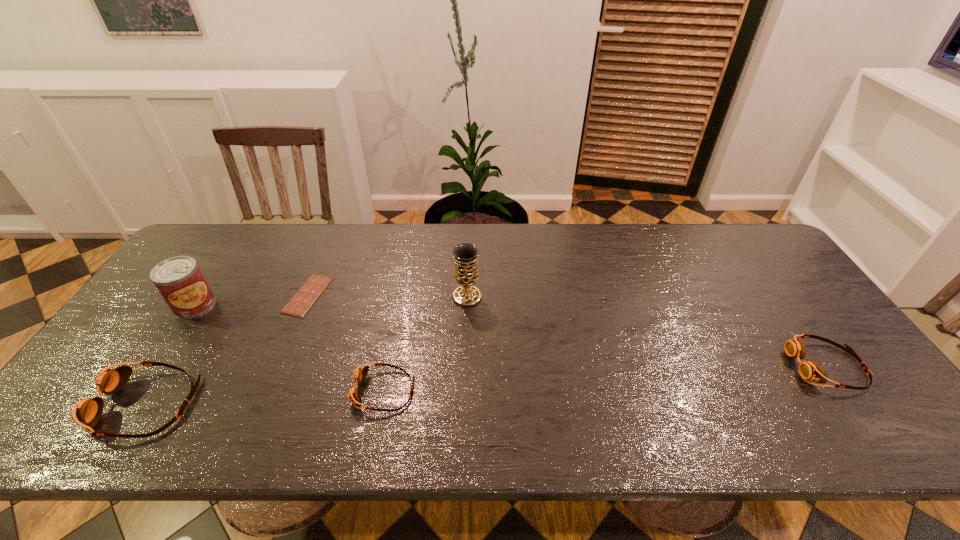
At what (x,y) coordinates should I click in order to perform the action: click on goggles at the left edge. Please return your answer as a coordinate pair (x, y). Looking at the image, I should click on (87, 413).

Locate an element on the screen. This screenshot has width=960, height=540. can positioned at the left edge is located at coordinates (179, 280).

Identify the location of object present at the right edge. (809, 370).

Image resolution: width=960 pixels, height=540 pixels. What are the coordinates of `object situated at the near left corner` in the screenshot? It's located at (87, 413).

The image size is (960, 540). In order to click on object at the near right corner in this screenshot , I will do `click(809, 370)`.

What are the coordinates of `free space at the far edge of the desktop` in the screenshot? It's located at (381, 235).

Where is `vacant position at the near edge of the desktop`? The width and height of the screenshot is (960, 540). vacant position at the near edge of the desktop is located at coordinates pos(174,386).

Locate an element on the screen. This screenshot has width=960, height=540. blank space at the left edge of the desktop is located at coordinates pos(206,269).

This screenshot has width=960, height=540. In order to click on vacant space at the far right corner of the desktop in this screenshot , I will do `click(769, 260)`.

In the image, there is a desktop. At what (x,y) coordinates should I click in order to perform the action: click on vacant space at the near right corner. Please return your answer as a coordinate pair (x, y). Looking at the image, I should click on (816, 396).